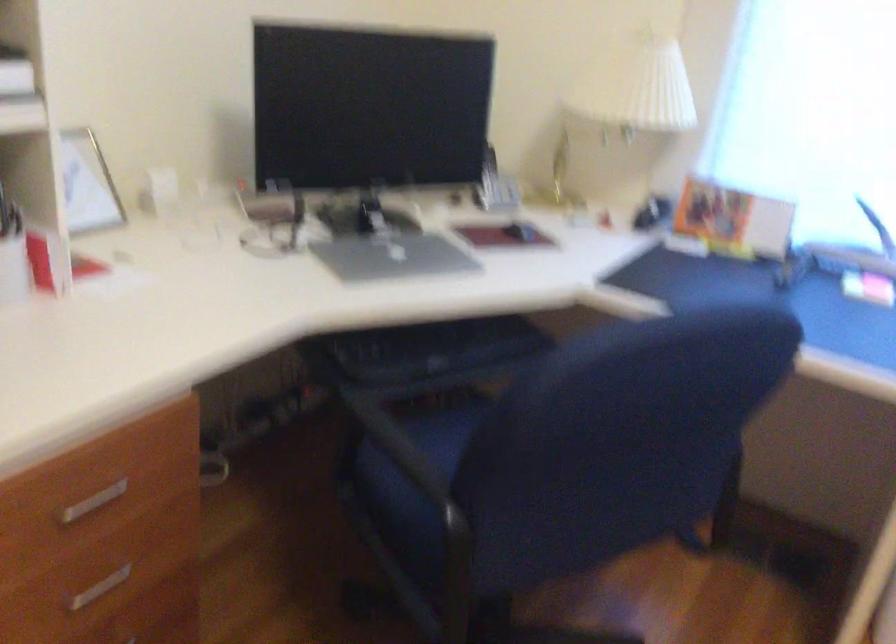
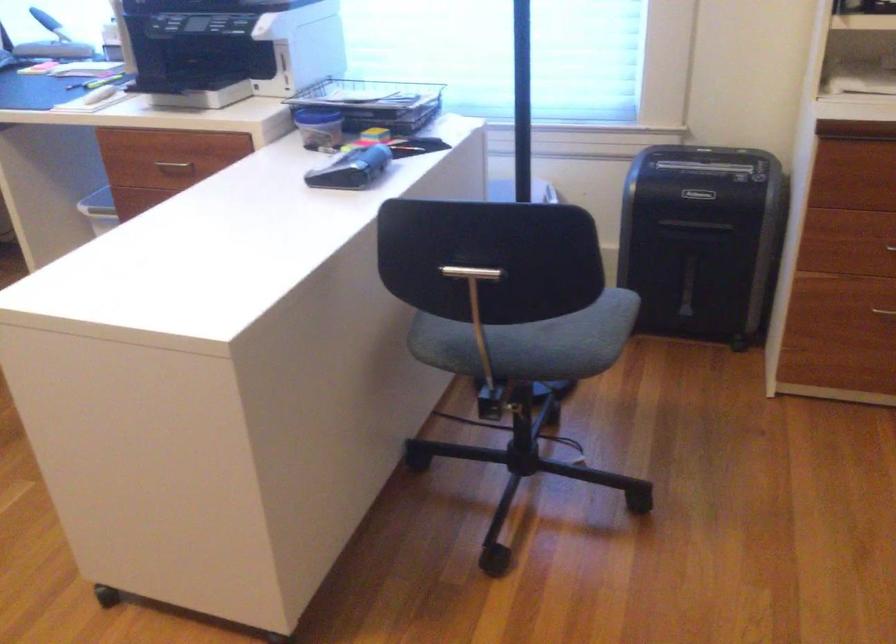
What movement of the cameraman would produce the second image?

The cameraman walked toward right, backward.